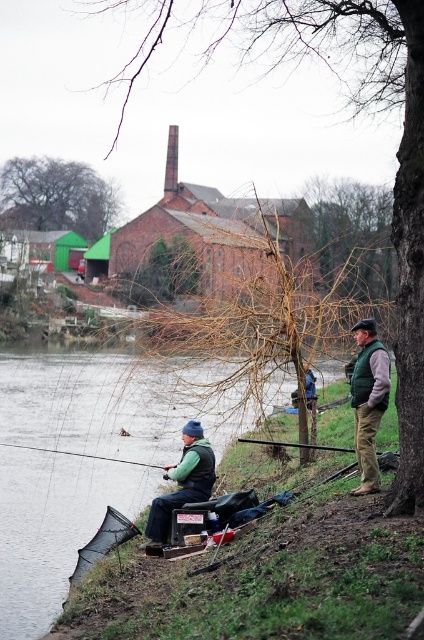
Question: Estimate the real-world distances between objects in this image. Which object is farther from the green plastic fishing pole at left?

Choices:
 (A) green fabric vest at lower right
 (B) matte green vest at center

Answer: (A)

Question: Which object is closer to the camera taking this photo?

Choices:
 (A) green plastic fishing pole at left
 (B) smooth black rod at lower center
 (C) matte green vest at center

Answer: (C)

Question: Which point is farther from the camera taking this photo?

Choices:
 (A) tap(125, 461)
 (B) tap(379, 451)

Answer: (A)

Question: Is green fabric vest at lower right thinner than smooth black rod at lower center?

Choices:
 (A) yes
 (B) no

Answer: (A)

Question: Can you confirm if green plastic fishing pole at left is positioned above smooth black rod at lower center?

Choices:
 (A) yes
 (B) no

Answer: (B)

Question: Is green plastic fishing pole at left smaller than smooth black rod at lower center?

Choices:
 (A) yes
 (B) no

Answer: (A)